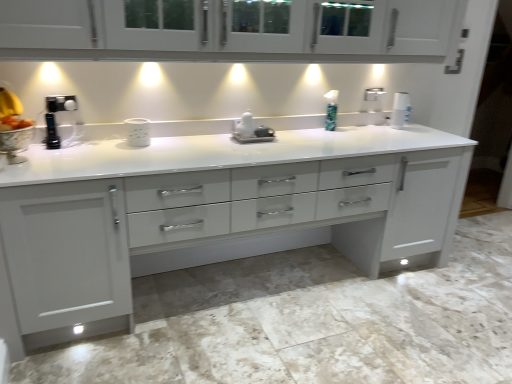
Locate an element on the screen. vacant area that is situated to the right of white glossy countertop at center is located at coordinates (424, 301).